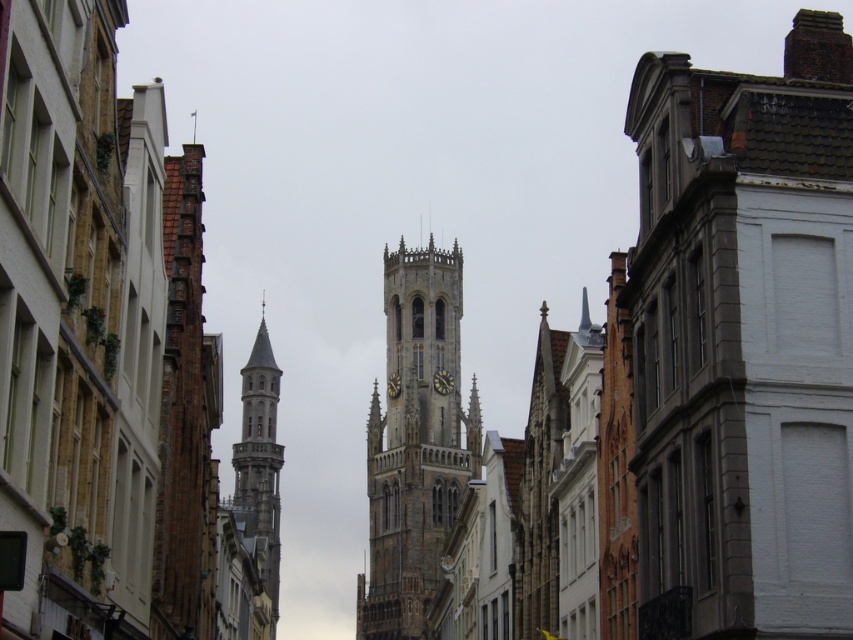
You are a tourist standing at the base of the street. You want to take a photo of the stone tower at center while also capturing the historic buildings on both sides of the street. Given that your camera can capture a maximum width of 34 meters, will you be able to fit all the buildings and the tower into a single photo?

The distance between the stone tower at center and the historic buildings on both sides of the street is 33.98 meters. Since your camera can capture a maximum width of 34 meters, you will be able to fit all the buildings and the tower into a single photo.

You are standing at the entrance of the narrow street and want to take a photo of the stone tower at center. According to the scene description, where should you position yourself to capture the tower in your camera frame?

You should position yourself at the entrance of the narrow street and aim your camera towards the center of the scene, specifically at the coordinates point (108, 356) where the stone tower at center is located.

You are standing on a narrow street in a historic European city and want to take a photo of two specific points. The first point is at coordinate point (433, 422) and the second is at coordinate point (258, 333). Which point will appear larger in your camera view?

Point (433, 422) is closer to the viewer than point (258, 333), so it will appear larger in the camera view.